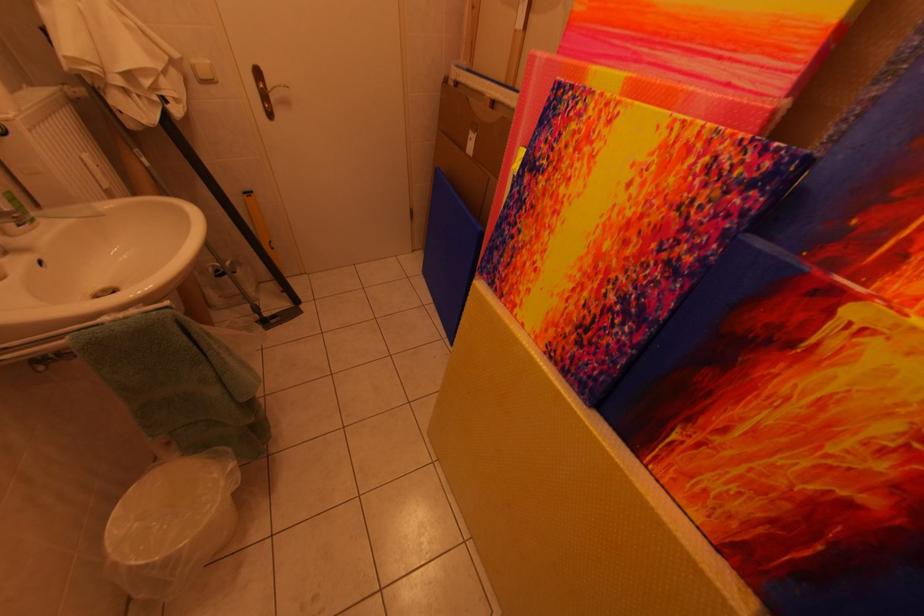
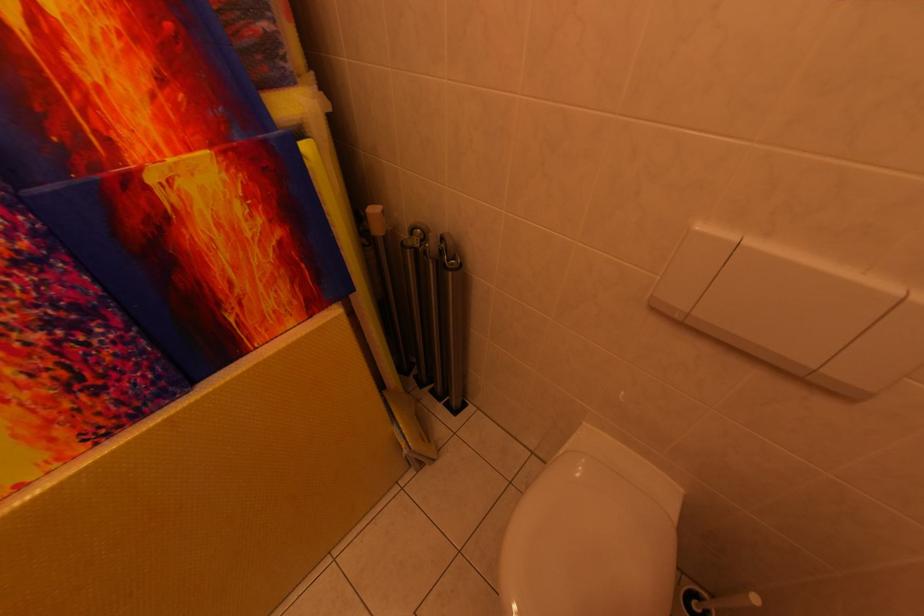
The first image is from the beginning of the video and the second image is from the end. How did the camera likely rotate when shooting the video?

The camera rotated toward right-down.